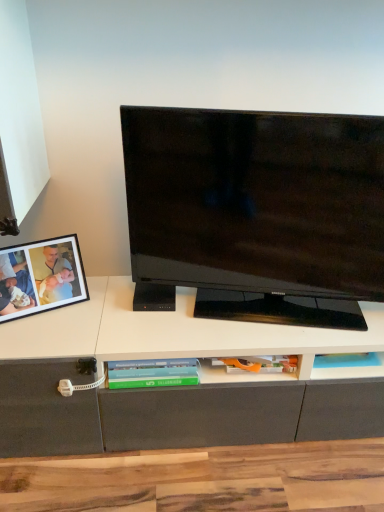
Question: From a real-world perspective, is matte black picture frame at left on top of black glossy television at center?

Choices:
 (A) no
 (B) yes

Answer: (A)

Question: Is matte black picture frame at left behind black glossy television at center?

Choices:
 (A) yes
 (B) no

Answer: (A)

Question: Is black glossy television at center inside matte black picture frame at left?

Choices:
 (A) yes
 (B) no

Answer: (B)

Question: Considering the relative positions of matte black picture frame at left and black glossy television at center in the image provided, is matte black picture frame at left to the left of black glossy television at center from the viewer's perspective?

Choices:
 (A) yes
 (B) no

Answer: (A)

Question: Is matte black picture frame at left facing away from black glossy television at center?

Choices:
 (A) yes
 (B) no

Answer: (B)

Question: Considering the relative sizes of matte black picture frame at left and black glossy television at center in the image provided, is matte black picture frame at left smaller than black glossy television at center?

Choices:
 (A) no
 (B) yes

Answer: (B)

Question: Can you confirm if green matte book at center is thinner than matte black picture frame at left?

Choices:
 (A) yes
 (B) no

Answer: (B)

Question: Is the position of green matte book at center less distant than that of matte black picture frame at left?

Choices:
 (A) yes
 (B) no

Answer: (B)

Question: Does green matte book at center have a smaller size compared to matte black picture frame at left?

Choices:
 (A) no
 (B) yes

Answer: (B)

Question: Would you say matte black picture frame at left is part of green matte book at center's contents?

Choices:
 (A) no
 (B) yes

Answer: (A)

Question: Is green matte book at center completely or partially outside of matte black picture frame at left?

Choices:
 (A) yes
 (B) no

Answer: (A)

Question: Considering the relative sizes of green matte book at center and matte black picture frame at left in the image provided, is green matte book at center wider than matte black picture frame at left?

Choices:
 (A) yes
 (B) no

Answer: (A)

Question: Considering the relative positions of black glossy television at center and matte black picture frame at left in the image provided, is black glossy television at center in front of matte black picture frame at left?

Choices:
 (A) yes
 (B) no

Answer: (A)